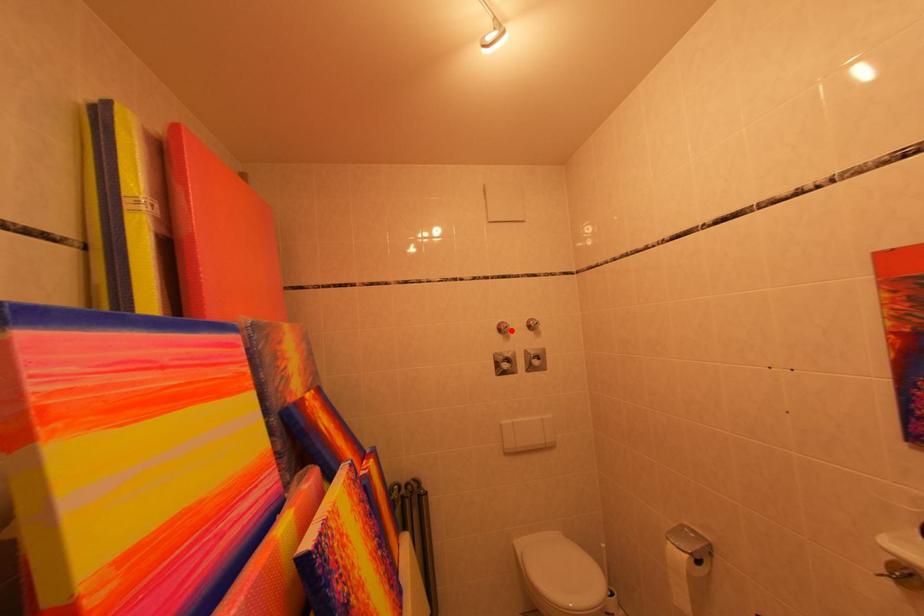
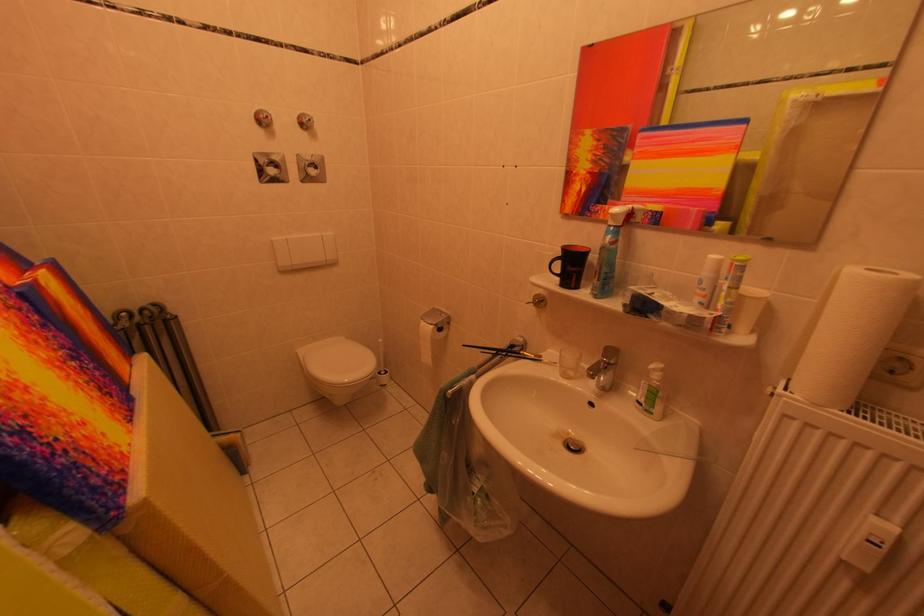
In the second image, find the point that corresponds to the highlighted location in the first image.

(271, 120)